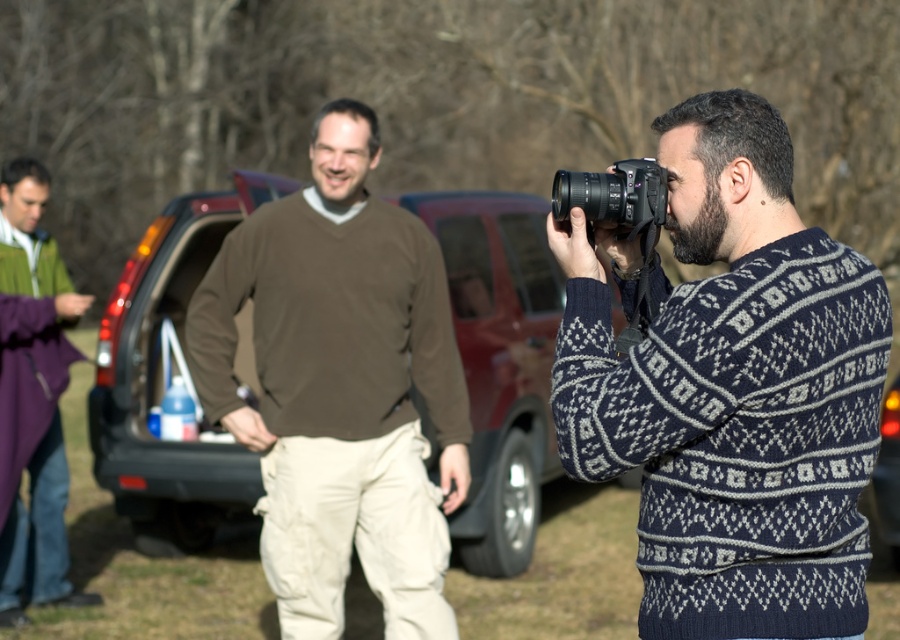
Based on the scene description, where is the navy blue sweater at center located in the image?

The navy blue sweater at center is located at point 0.613 on the x axis and 0.816 on the y axis.

You are a photographer standing in the scene. You need to adjust your camera to focus on the brown cotton sweater at center and the matte brown car at center. Which object should you set a closer focus distance for?

The brown cotton sweater at center has a lesser height compared to matte brown car at center, so you should set a closer focus distance for the brown cotton sweater at center since it is closer to the camera.

You are a photographer trying to capture a shot of the matte brown car at center. There is a person wearing a brown cotton sweater at center blocking your view. Can you move to the right side of the car to get an unobstructed view?

The brown cotton sweater at center is positioned on the left side of the matte brown car at center, so moving to the right side of the car would allow you to get an unobstructed view.